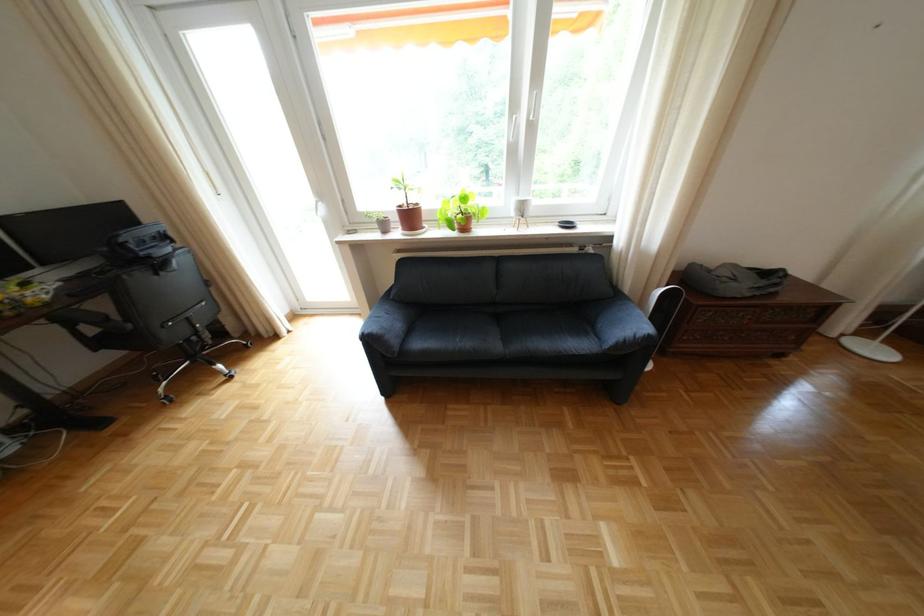
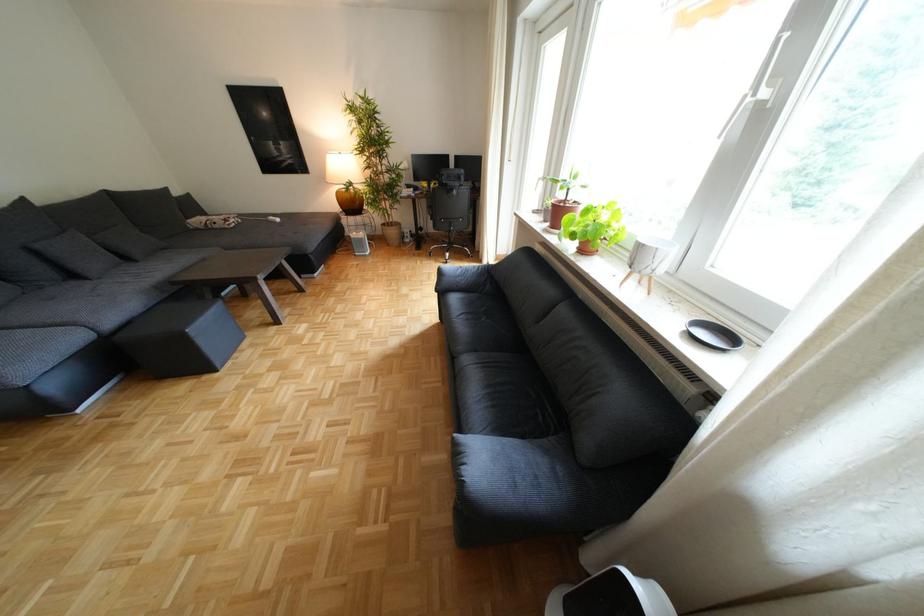
Where in the second image is the point corresponding to (x=127, y=428) from the first image?

(430, 252)